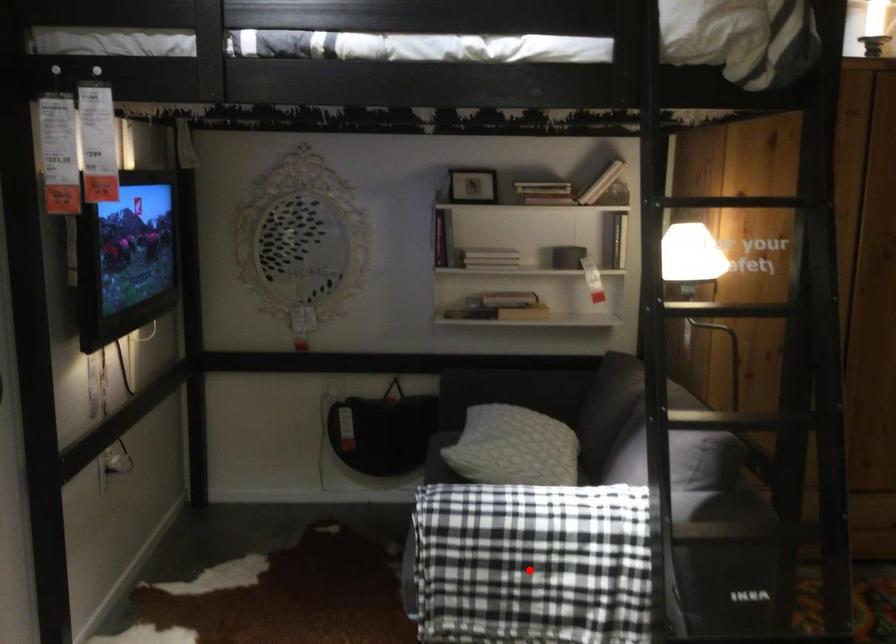
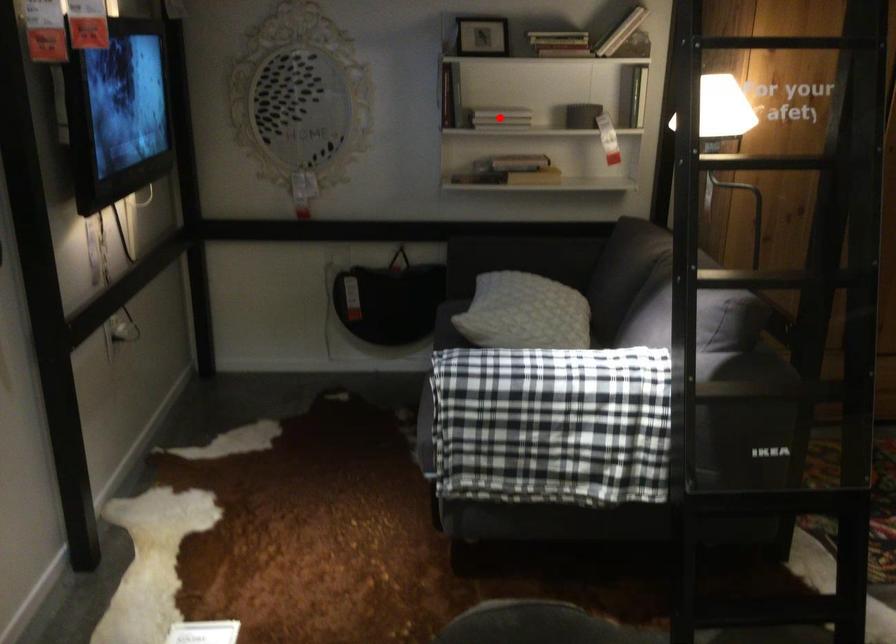
I am providing you with two images of the same scene from different viewpoints. A red point is marked on the first image and another point is marked on the second image. Does the point marked in image1 correspond to the same location as the one in image2?

No